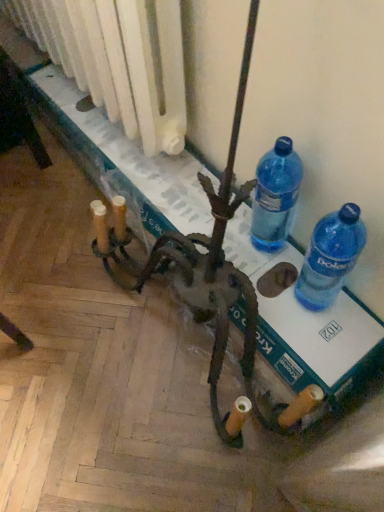
I want to click on white matte radiator at upper left, so click(x=118, y=60).

In order to face white matte radiator at upper left, should I rotate leftwards or rightwards?

To align with it, rotate left about 16.893°.

What do you see at coordinates (118, 60) in the screenshot? The image size is (384, 512). I see `white matte radiator at upper left` at bounding box center [118, 60].

Find the location of a particular element. Image resolution: width=384 pixels, height=512 pixels. white matte radiator at upper left is located at coordinates (118, 60).